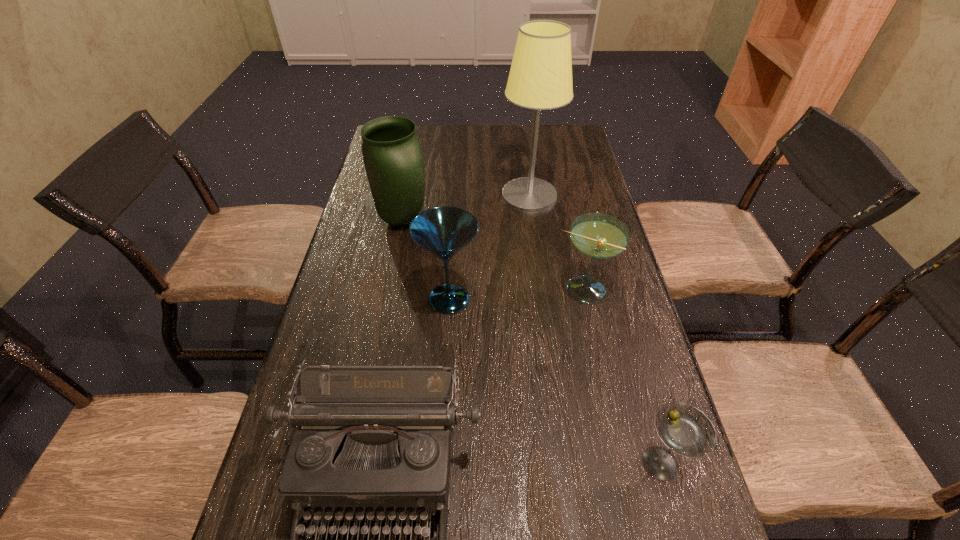
This screenshot has width=960, height=540. I want to click on table lamp at the right edge, so click(540, 78).

At what (x,y) coordinates should I click in order to perform the action: click on vacant space at the far edge. Please return your answer as a coordinate pair (x, y). Image resolution: width=960 pixels, height=540 pixels. Looking at the image, I should click on (481, 157).

This screenshot has width=960, height=540. I want to click on vacant space at the left edge of the desktop, so 348,295.

Locate an element on the screen. free location at the right edge of the desktop is located at coordinates (605, 308).

I want to click on free area in between the nearest martini and the tallest object, so click(x=595, y=330).

Identify which object is the second closest to the second tallest object. Please provide its 2D coordinates. Your answer should be formatted as a tuple, i.e. [(x, y)], where the tuple contains the x and y coordinates of a point satisfying the conditions above.

[(540, 78)]

Where is `the third closest object to the typewriter`? This screenshot has width=960, height=540. the third closest object to the typewriter is located at coordinates (600, 236).

Point out which martini is positioned as the nearest to the leftmost martini. Please provide its 2D coordinates. Your answer should be formatted as a tuple, i.e. [(x, y)], where the tuple contains the x and y coordinates of a point satisfying the conditions above.

[(600, 236)]

Identify the location of martini that is the second closest one to the leftmost martini. (686, 430).